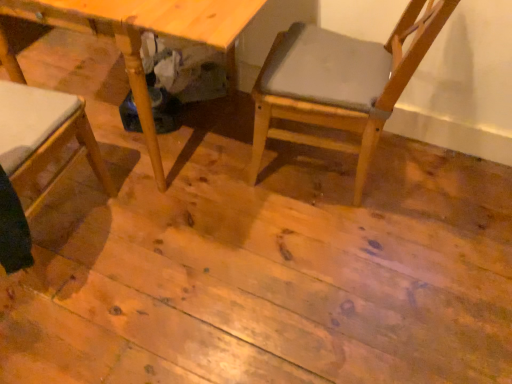
Question: Is point (346, 87) closer or farther from the camera than point (197, 8)?

Choices:
 (A) closer
 (B) farther

Answer: (B)

Question: Considering the positions of light brown wood chair at center and natural wood table at center in the image, is light brown wood chair at center wider or thinner than natural wood table at center?

Choices:
 (A) thin
 (B) wide

Answer: (A)

Question: Based on their sizes in the image, would you say light brown wood chair at center is bigger or smaller than natural wood table at center?

Choices:
 (A) small
 (B) big

Answer: (A)

Question: Considering the positions of natural wood table at center and light brown wood chair at center in the image, is natural wood table at center bigger or smaller than light brown wood chair at center?

Choices:
 (A) big
 (B) small

Answer: (A)

Question: Would you say natural wood table at center is to the left or to the right of light brown wood chair at center in the picture?

Choices:
 (A) left
 (B) right

Answer: (A)

Question: Considering the positions of point (123, 1) and point (251, 173), is point (123, 1) closer or farther from the camera than point (251, 173)?

Choices:
 (A) closer
 (B) farther

Answer: (A)

Question: From the image's perspective, relative to light brown wood chair at center, is natural wood table at center above or below?

Choices:
 (A) above
 (B) below

Answer: (A)